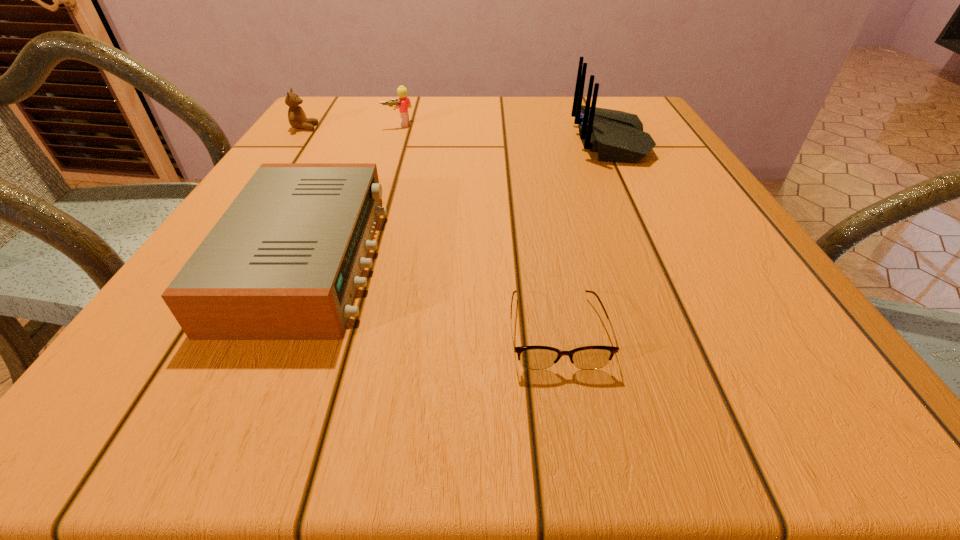
Image resolution: width=960 pixels, height=540 pixels. I want to click on the tallest object, so click(x=617, y=136).

Locate an element on the screen. router is located at coordinates (617, 136).

Locate an element on the screen. The height and width of the screenshot is (540, 960). Lego is located at coordinates (404, 103).

What are the coordinates of `teddy bear` in the screenshot? It's located at (297, 118).

I want to click on radio receiver, so click(284, 261).

Where is `spectacles`? spectacles is located at coordinates (531, 357).

Identify the location of the fourth object from left to right. click(x=531, y=357).

I want to click on vacant space positioned 0.340m on the back of the router, so click(x=430, y=141).

This screenshot has height=540, width=960. I want to click on vacant space located 0.360m on the back of the router, so coord(421,141).

Identify the location of free spot located on the back of the router. The image size is (960, 540). (443, 141).